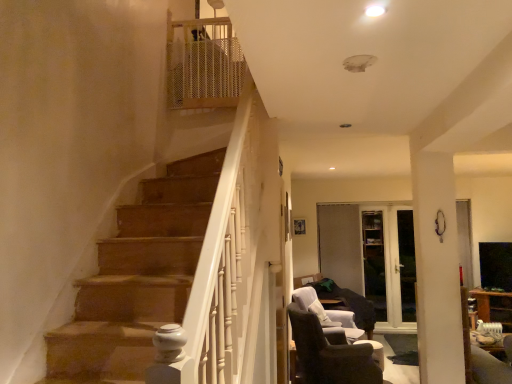
Question: Would you say dark brown fabric chair at lower right, which appears as the 1th chair when viewed from the back, is a long distance from dark brown fabric chair at lower right, the first chair in the front-to-back sequence?

Choices:
 (A) yes
 (B) no

Answer: (A)

Question: Can you see dark brown fabric chair at lower right, acting as the 2th chair starting from the front, touching dark brown fabric chair at lower right, the first chair in the front-to-back sequence?

Choices:
 (A) no
 (B) yes

Answer: (A)

Question: Can you confirm if dark brown fabric chair at lower right, acting as the 2th chair starting from the front, is smaller than dark brown fabric chair at lower right, which is the 2th chair from back to front?

Choices:
 (A) no
 (B) yes

Answer: (B)

Question: Is dark brown fabric chair at lower right, which appears as the 1th chair when viewed from the back, at the right side of dark brown fabric chair at lower right, which is the 2th chair from back to front?

Choices:
 (A) no
 (B) yes

Answer: (B)

Question: Is dark brown fabric chair at lower right, which appears as the 1th chair when viewed from the back, taller than dark brown fabric chair at lower right, the first chair in the front-to-back sequence?

Choices:
 (A) yes
 (B) no

Answer: (B)

Question: Is dark brown fabric chair at lower right, acting as the 2th chair starting from the front, at the left side of dark brown fabric chair at lower right, which is the 2th chair from back to front?

Choices:
 (A) yes
 (B) no

Answer: (B)

Question: Is dark brown fabric chair at lower right, the first chair in the front-to-back sequence, positioned with its back to white glossy ceiling light at upper center?

Choices:
 (A) no
 (B) yes

Answer: (A)

Question: Are dark brown fabric chair at lower right, the first chair in the front-to-back sequence, and white glossy ceiling light at upper center far apart?

Choices:
 (A) no
 (B) yes

Answer: (B)

Question: Is dark brown fabric chair at lower right, the first chair in the front-to-back sequence, thinner than white glossy ceiling light at upper center?

Choices:
 (A) no
 (B) yes

Answer: (A)

Question: From the image's perspective, is dark brown fabric chair at lower right, the first chair in the front-to-back sequence, under white glossy ceiling light at upper center?

Choices:
 (A) no
 (B) yes

Answer: (B)

Question: Considering the relative positions of dark brown fabric chair at lower right, the first chair in the front-to-back sequence, and white glossy ceiling light at upper center in the image provided, is dark brown fabric chair at lower right, the first chair in the front-to-back sequence, to the right of white glossy ceiling light at upper center from the viewer's perspective?

Choices:
 (A) yes
 (B) no

Answer: (A)

Question: From a real-world perspective, does dark brown fabric chair at lower right, which is the 2th chair from back to front, stand above white glossy ceiling light at upper center?

Choices:
 (A) no
 (B) yes

Answer: (A)

Question: Is transparent glass door at center, which is the first glass door from left to right, positioned far away from dark brown fabric chair at lower right, which appears as the 1th chair when viewed from the back?

Choices:
 (A) no
 (B) yes

Answer: (B)